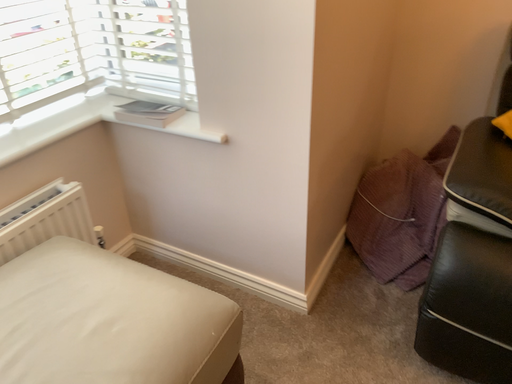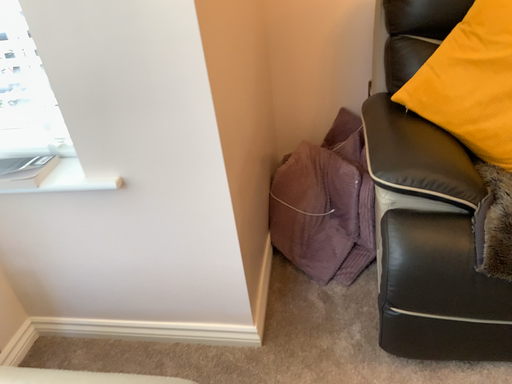
Question: Which way did the camera rotate in the video?

Choices:
 (A) rotated right
 (B) rotated left

Answer: (A)